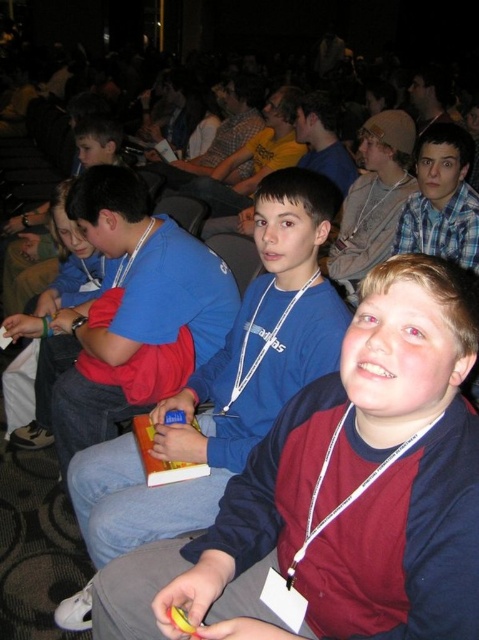
Question: Can you confirm if blue cotton shirt at center is smaller than blue fabric shirt at left?

Choices:
 (A) yes
 (B) no

Answer: (B)

Question: Does blue cotton shirt at center come behind blue denim jeans at center?

Choices:
 (A) yes
 (B) no

Answer: (B)

Question: Does blue cotton shirt at center appear under blue denim jeans at center?

Choices:
 (A) yes
 (B) no

Answer: (A)

Question: Which point is closer to the camera?

Choices:
 (A) click(x=4, y=324)
 (B) click(x=376, y=237)
 (C) click(x=267, y=179)

Answer: (C)

Question: Which of the following is the farthest from the observer?

Choices:
 (A) blue fabric shirt at left
 (B) blue cotton shirt at center
 (C) blue denim jeans at center

Answer: (C)

Question: Which of these objects is positioned closest to the blue denim jeans at center?

Choices:
 (A) blue cotton shirt at center
 (B) blue fabric shirt at left

Answer: (B)